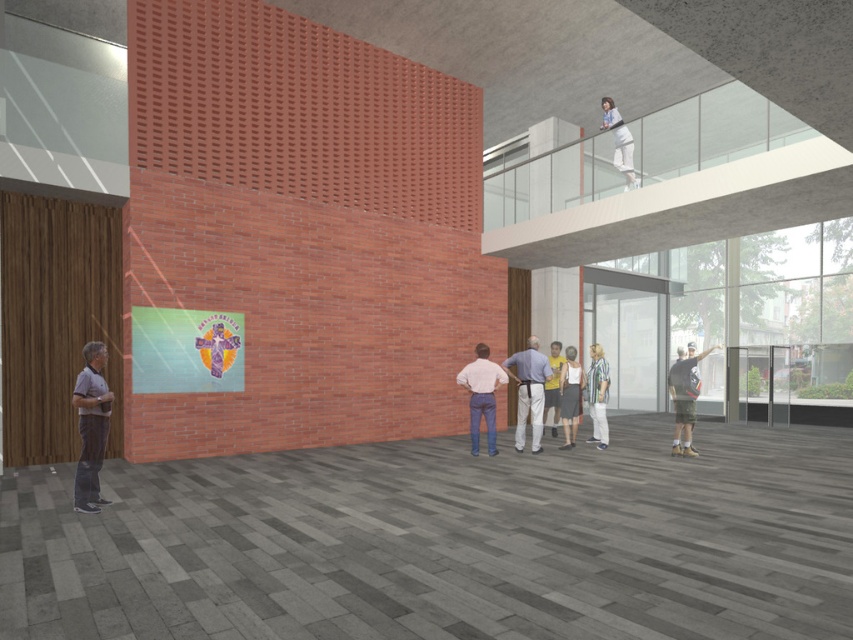
Question: Which of the following is the closest to the observer?

Choices:
 (A) white cotton pants at center
 (B) white fabric at upper center
 (C) brick wall at lower center
 (D) white cotton dress at center

Answer: (C)

Question: Which object appears closest to the camera in this image?

Choices:
 (A) white fabric at upper center
 (B) striped cotton shirt at center
 (C) white cotton pants at center

Answer: (C)

Question: Is striped cotton shirt at center above yellow t-shirt at center?

Choices:
 (A) no
 (B) yes

Answer: (A)

Question: Among these objects, which one is nearest to the camera?

Choices:
 (A) matte pink shirt at center
 (B) white cotton pants at center

Answer: (A)

Question: Is matte pink shirt at center closer to the viewer compared to white fabric at upper center?

Choices:
 (A) no
 (B) yes

Answer: (B)

Question: Is brick wall at lower center to the left of dark gray shorts at lower right from the viewer's perspective?

Choices:
 (A) yes
 (B) no

Answer: (A)